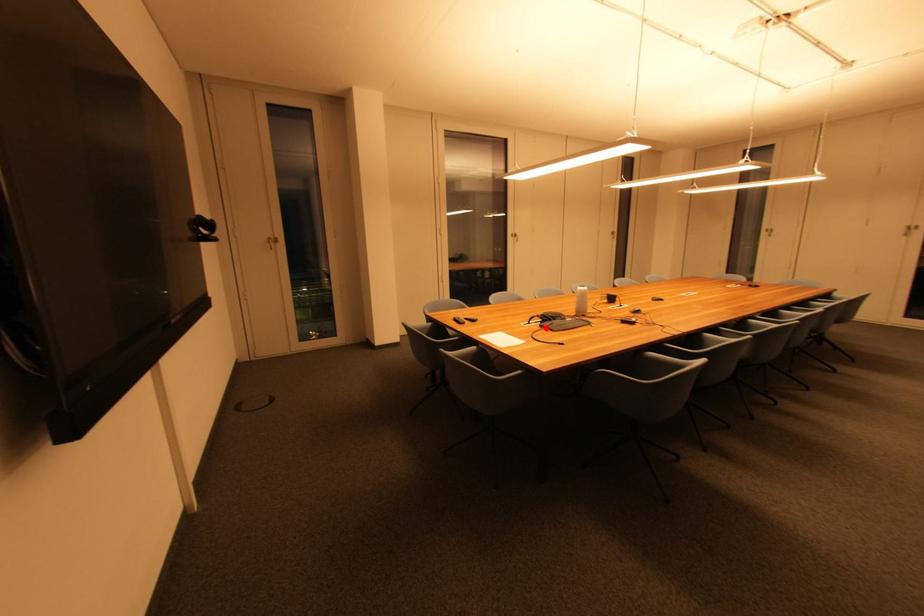
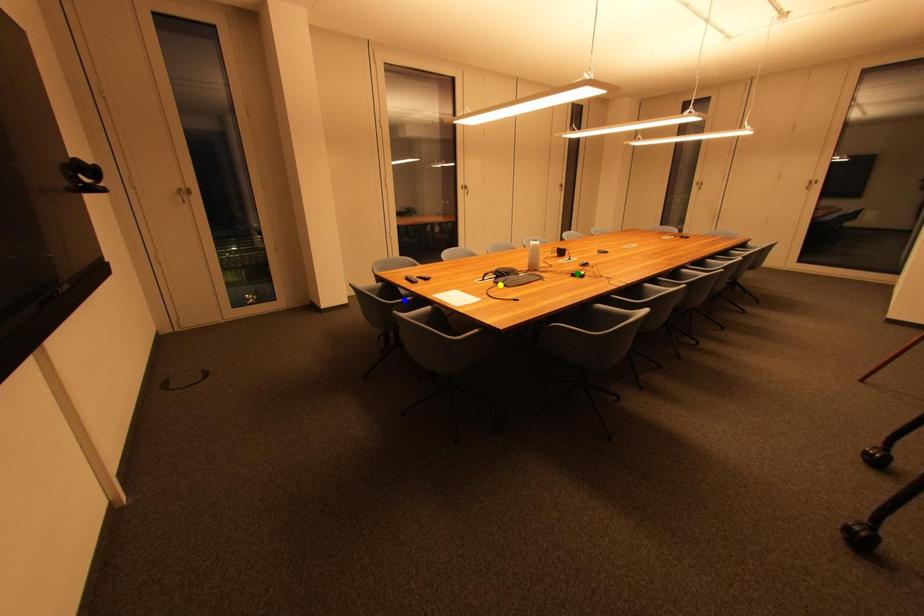
Question: I am providing you with two images of the same scene from different viewpoints. A red point is marked on the first image. You are given multiple points on the second image. Which mark in image 2 goes with the point in image 1?

Choices:
 (A) blue point
 (B) green point
 (C) yellow point

Answer: (C)